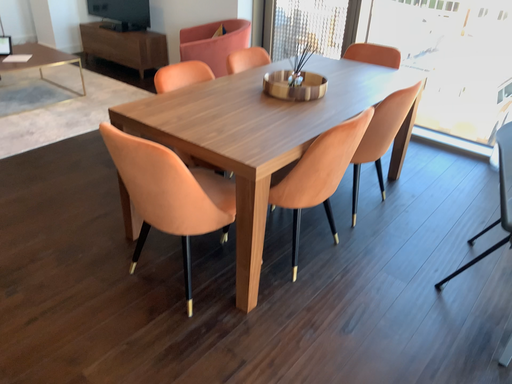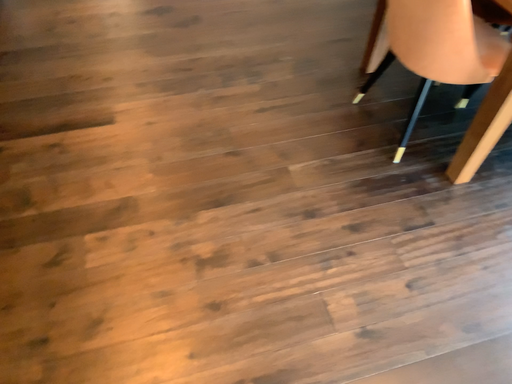
Question: Which way did the camera rotate in the video?

Choices:
 (A) rotated upward
 (B) rotated downward

Answer: (B)